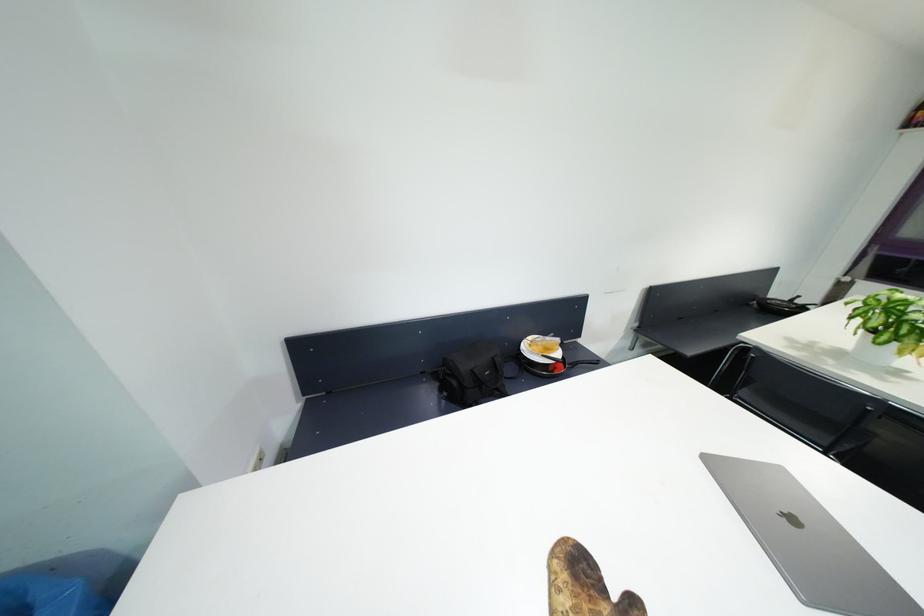
The location [886,326] corresponds to which object?

It refers to a white plant pot.